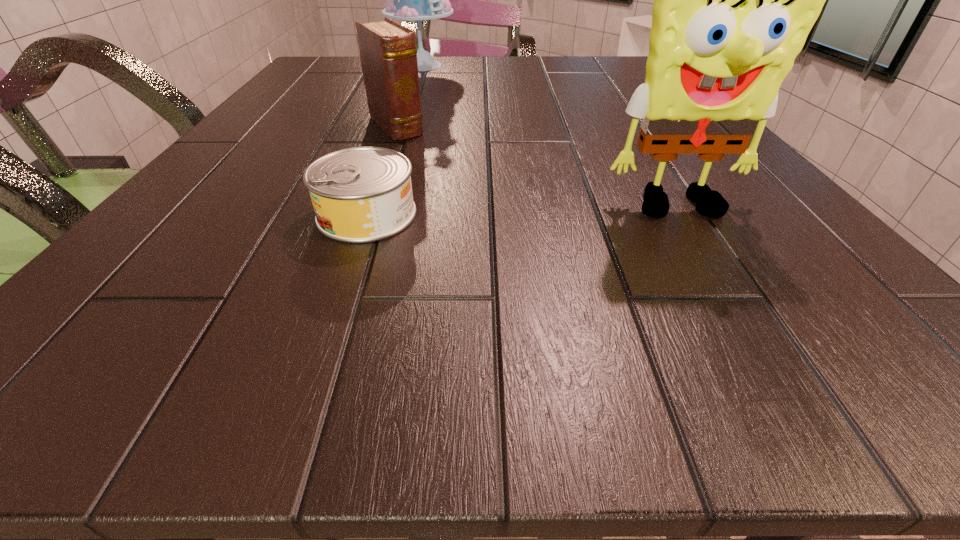
Identify the location of free space on the desktop that is between the can and the sponge and is positioned on the spine side of the second shortest object. Image resolution: width=960 pixels, height=540 pixels. (491, 213).

The image size is (960, 540). Identify the location of free space on the desktop that is between the can and the sponge and is positioned with a ladder on the side of the farthest object. click(478, 213).